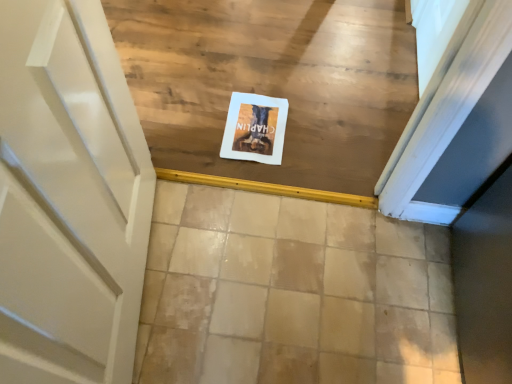
Question: Looking at their shapes, would you say white paper at center is wider or thinner than beige tile at center?

Choices:
 (A) thin
 (B) wide

Answer: (A)

Question: From a real-world perspective, is white paper at center above or below beige tile at center?

Choices:
 (A) above
 (B) below

Answer: (A)

Question: From their relative heights in the image, would you say white paper at center is taller or shorter than beige tile at center?

Choices:
 (A) tall
 (B) short

Answer: (B)

Question: From a real-world perspective, relative to white paper at center, is beige tile at center vertically above or below?

Choices:
 (A) above
 (B) below

Answer: (B)

Question: Does point (320, 349) appear closer or farther from the camera than point (240, 135)?

Choices:
 (A) farther
 (B) closer

Answer: (B)

Question: Which is correct: beige tile at center is inside white paper at center, or outside of it?

Choices:
 (A) inside
 (B) outside

Answer: (B)

Question: Would you say beige tile at center is to the left or to the right of white paper at center in the picture?

Choices:
 (A) right
 (B) left

Answer: (A)